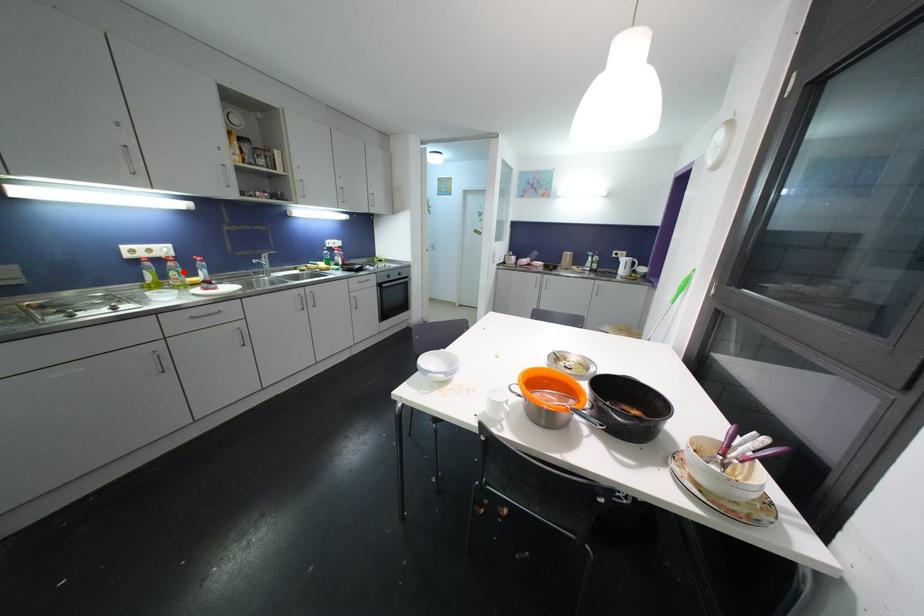
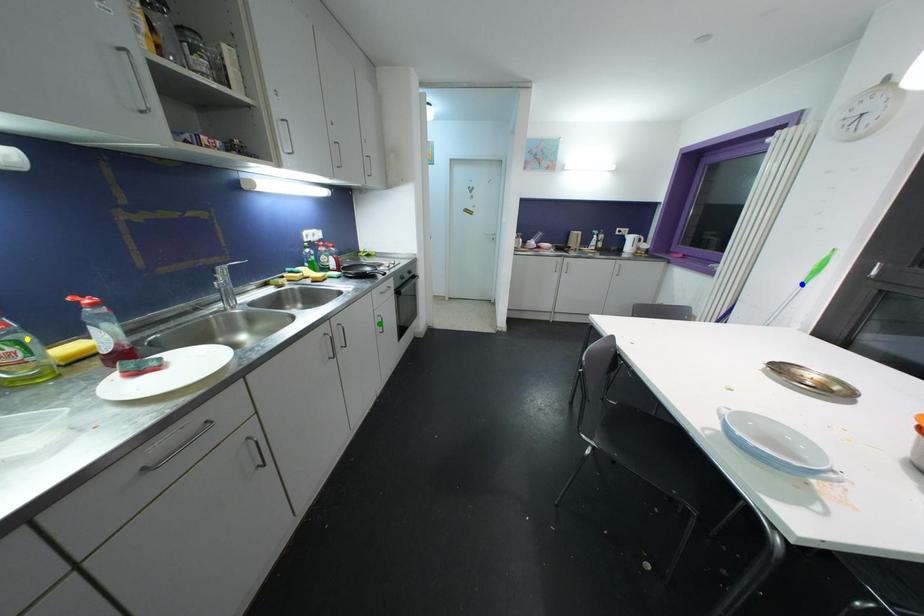
Question: I am providing you with two images of the same scene from different viewpoints. A red point is marked on the first image. You are given multiple points on the second image. Can you choose the point in image 2 that corresponds to the point in image 1?

Choices:
 (A) yellow point
 (B) green point
 (C) blue point

Answer: (A)